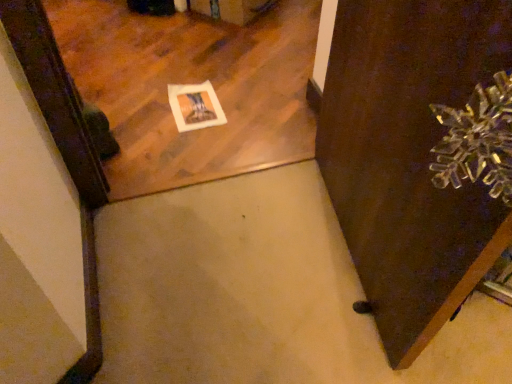
Locate an element on the screen. Image resolution: width=512 pixels, height=384 pixels. brown wooden door at right is located at coordinates (409, 157).

Describe the element at coordinates (409, 157) in the screenshot. I see `brown wooden door at right` at that location.

Where is `matte wooden mirror at upper left`? The width and height of the screenshot is (512, 384). matte wooden mirror at upper left is located at coordinates (191, 83).

This screenshot has height=384, width=512. Describe the element at coordinates (191, 83) in the screenshot. I see `matte wooden mirror at upper left` at that location.

The height and width of the screenshot is (384, 512). Identify the location of brown wooden door at right. (409, 157).

Considering the positions of objects brown wooden door at right and matte wooden mirror at upper left in the image provided, who is more to the right, brown wooden door at right or matte wooden mirror at upper left?

From the viewer's perspective, brown wooden door at right appears more on the right side.

Is brown wooden door at right further to camera compared to matte wooden mirror at upper left?

No, brown wooden door at right is closer to the viewer.

Considering the points (348, 183) and (182, 42), which point is in front, point (348, 183) or point (182, 42)?

The point (348, 183) is in front.

Consider the image. From the image's perspective, relative to matte wooden mirror at upper left, is brown wooden door at right above or below?

brown wooden door at right is situated lower than matte wooden mirror at upper left in the image.

From a real-world perspective, is brown wooden door at right physically above matte wooden mirror at upper left?

Correct, in the physical world, brown wooden door at right is higher than matte wooden mirror at upper left.

Which object is wider, brown wooden door at right or matte wooden mirror at upper left?

With larger width is matte wooden mirror at upper left.

From their relative heights in the image, would you say brown wooden door at right is taller or shorter than matte wooden mirror at upper left?

Considering their sizes, brown wooden door at right has more height than matte wooden mirror at upper left.

Can you confirm if brown wooden door at right is smaller than matte wooden mirror at upper left?

Actually, brown wooden door at right might be larger than matte wooden mirror at upper left.

Is brown wooden door at right positioned beyond the bounds of matte wooden mirror at upper left?

Yes.

Is brown wooden door at right beside matte wooden mirror at upper left?

No, brown wooden door at right is not beside matte wooden mirror at upper left.

Is brown wooden door at right oriented away from matte wooden mirror at upper left?

No.

The image size is (512, 384). In the image, there is a brown wooden door at right. Identify the location of mirror above it (from the image's perspective). (191, 83).

In the image, is matte wooden mirror at upper left on the left side or the right side of brown wooden door at right?

matte wooden mirror at upper left is to the left of brown wooden door at right.

Does matte wooden mirror at upper left lie in front of brown wooden door at right?

No.

Is point (141, 121) behind point (384, 125)?

Yes.

Based on the photo, from the image's perspective, is matte wooden mirror at upper left below brown wooden door at right?

Incorrect, from the image's perspective, matte wooden mirror at upper left is higher than brown wooden door at right.

From a real-world perspective, relative to brown wooden door at right, is matte wooden mirror at upper left vertically above or below?

matte wooden mirror at upper left is situated lower than brown wooden door at right in the real world.

Which object is wider, matte wooden mirror at upper left or brown wooden door at right?

matte wooden mirror at upper left is wider.

Considering the sizes of objects matte wooden mirror at upper left and brown wooden door at right in the image provided, who is taller, matte wooden mirror at upper left or brown wooden door at right?

brown wooden door at right.

Does matte wooden mirror at upper left have a smaller size compared to brown wooden door at right?

Yes.

Is brown wooden door at right located within matte wooden mirror at upper left?

Actually, brown wooden door at right is outside matte wooden mirror at upper left.

Can you see matte wooden mirror at upper left touching brown wooden door at right?

No, matte wooden mirror at upper left is not beside brown wooden door at right.

Could you tell me if matte wooden mirror at upper left is facing brown wooden door at right?

No, matte wooden mirror at upper left is not oriented towards brown wooden door at right.

Can you tell me how much matte wooden mirror at upper left and brown wooden door at right differ in facing direction?

They differ by 97.8 degrees in their facing directions.

Locate an element on the screen. door in front of the matte wooden mirror at upper left is located at coordinates (409, 157).

The height and width of the screenshot is (384, 512). I want to click on door located in front of the matte wooden mirror at upper left, so tap(409, 157).

Find the location of a particular element. The width and height of the screenshot is (512, 384). door that appears on the right of matte wooden mirror at upper left is located at coordinates (409, 157).